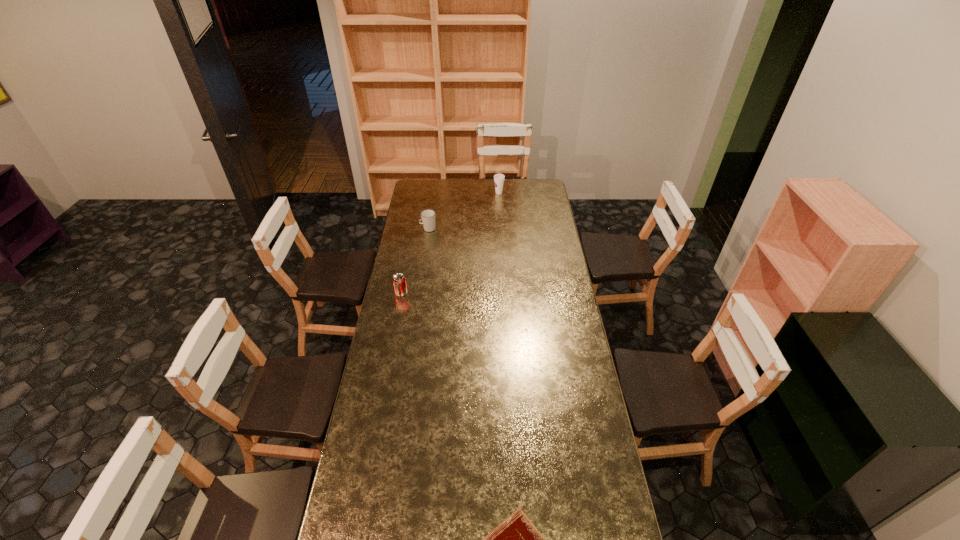
I want to click on free location located on the right of the soda can, so (444, 293).

You are a GUI agent. You are given a task and a screenshot of the screen. Output one action in this format:
    pyautogui.click(x=<x>, y=<y>)
    Task: Click on the object that is at the far edge
    The image size is (960, 540).
    Given the screenshot: What is the action you would take?
    pyautogui.click(x=498, y=178)

Find the location of `cup that is at the left edge`. cup that is at the left edge is located at coordinates (427, 216).

Identify the location of soda can that is at the left edge. This screenshot has height=540, width=960. (399, 281).

Where is `free space at the far edge of the desktop`? This screenshot has width=960, height=540. free space at the far edge of the desktop is located at coordinates (461, 187).

Locate an element on the screen. vacant space at the left edge of the desktop is located at coordinates tap(398, 455).

You are a GUI agent. You are given a task and a screenshot of the screen. Output one action in this format:
    pyautogui.click(x=<x>, y=<y>)
    Task: Click on the vacant space at the right edge of the desktop
    
    Given the screenshot: What is the action you would take?
    pyautogui.click(x=544, y=249)

This screenshot has width=960, height=540. Find the location of `vacant area between the leftmost object and the left cup`. vacant area between the leftmost object and the left cup is located at coordinates (415, 261).

Find the location of a particular element. empty space that is in between the farther cup and the second farthest object is located at coordinates (464, 211).

Where is `free space between the nearer cup and the third farthest object`? free space between the nearer cup and the third farthest object is located at coordinates (415, 261).